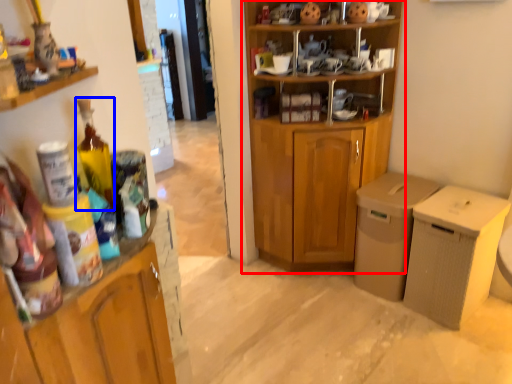
Question: Which object appears farthest to the camera in this image, cupboard (highlighted by a red box) or bottle (highlighted by a blue box)?

Choices:
 (A) cupboard
 (B) bottle

Answer: (A)